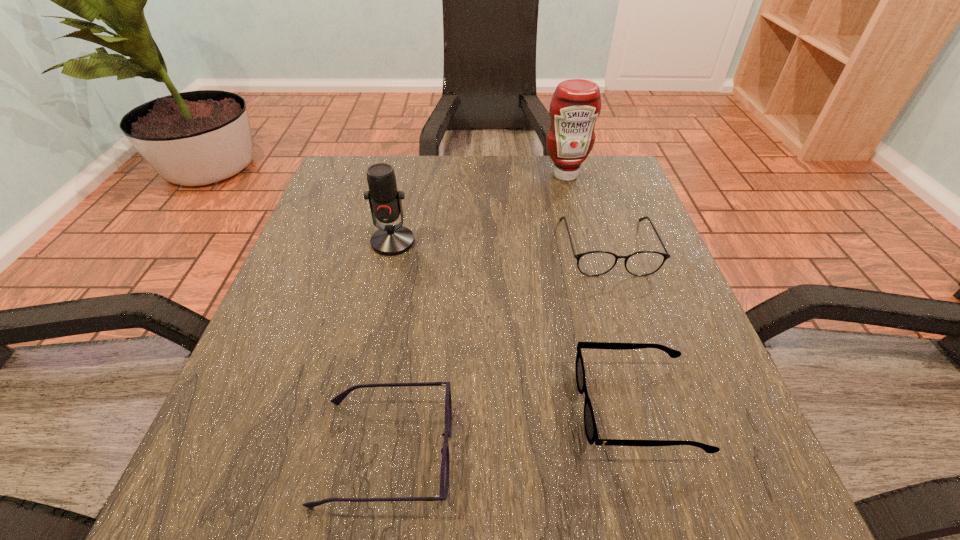
This screenshot has width=960, height=540. Find the location of `the tallest object`. the tallest object is located at coordinates (576, 104).

Find the location of `the farthest object`. the farthest object is located at coordinates (576, 104).

At what (x,y) coordinates should I click in order to perform the action: click on the fourth shortest object. Please return your answer as a coordinate pair (x, y). This screenshot has width=960, height=540. Looking at the image, I should click on (385, 203).

Where is `the farthest spectacles`? the farthest spectacles is located at coordinates (594, 263).

Find the location of a particular element. This screenshot has height=540, width=960. the leftmost spectacles is located at coordinates click(x=445, y=461).

This screenshot has height=540, width=960. I want to click on vacant space situated on the right of the tallest object, so click(x=628, y=175).

At what (x,y) coordinates should I click in order to perform the action: click on vacant region located 0.110m on the side of the microphone with the red ring. Please return your answer as a coordinate pair (x, y). Image resolution: width=960 pixels, height=540 pixels. Looking at the image, I should click on (381, 295).

At what (x,y) coordinates should I click in order to perform the action: click on vacant region located on the front-facing side of the farthest spectacles. Please return your answer as a coordinate pair (x, y). This screenshot has width=960, height=540. Looking at the image, I should click on (638, 344).

At what (x,y) coordinates should I click in order to perform the action: click on vacant point located 0.140m on the front-facing side of the leftmost spectacles. Please return your answer as a coordinate pair (x, y). The width and height of the screenshot is (960, 540). Looking at the image, I should click on (554, 452).

Where is `object at the far edge`? object at the far edge is located at coordinates (576, 104).